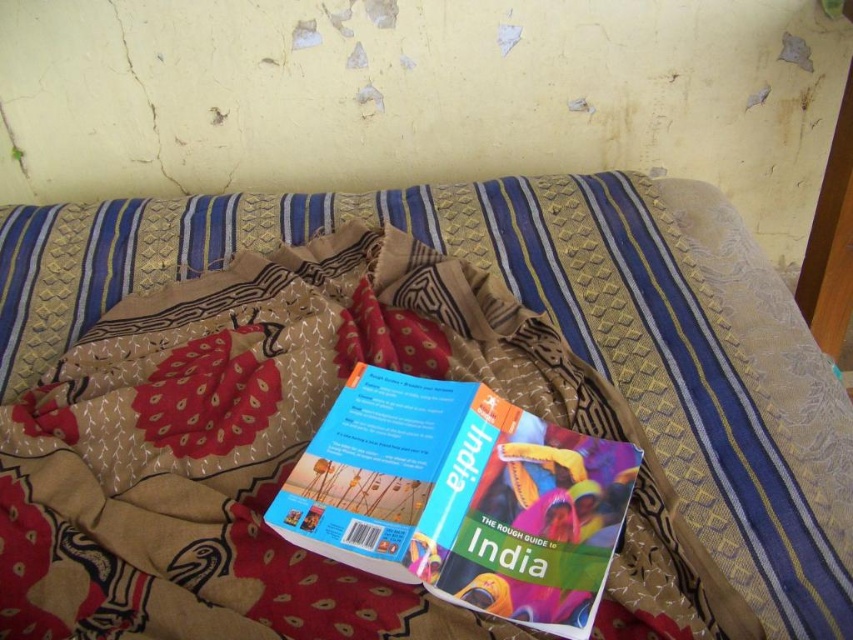
In the scene shown: You are standing in a room with a bed and want to place a small lamp on the floor near the textured fabric bed at center. If the lamp is 0.3 meters in diameter, will it fit in the space around the bed?

The position of the textured fabric bed at center is at point (412, 372), but without information about the bed dimensions or the available space around it, it is impossible to determine if the lamp will fit.

You are organizing a small display on travel literature and need to place the hardcover book at center on top of the textured fabric bed at center. Given that the book is 20 cm wide, can you confirm if the bedspread will fully cover the book when placed centrally?

The textured fabric bed at center has a larger size compared to the hardcover book at center, so yes, the bedspread will fully cover the book when placed centrally.